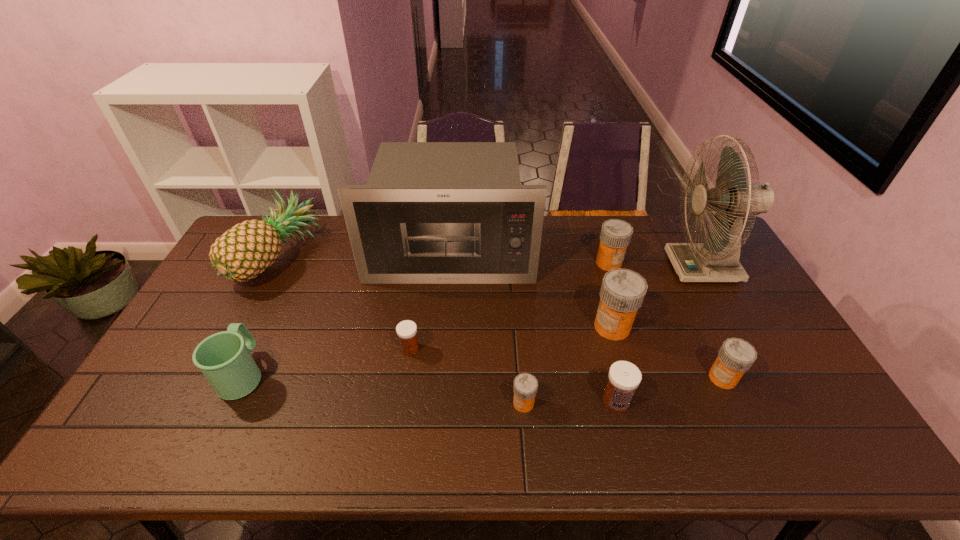
Identify the location of fan. (717, 259).

Where is `gray fan`? Image resolution: width=960 pixels, height=540 pixels. gray fan is located at coordinates (717, 259).

The height and width of the screenshot is (540, 960). In order to click on gray microwave oven in this screenshot , I will do `click(431, 212)`.

Find the location of `the ninth shortest object`. the ninth shortest object is located at coordinates (431, 212).

Identify the location of pineapple. (247, 249).

The width and height of the screenshot is (960, 540). I want to click on the second farthest orange medicine, so click(x=622, y=292).

Locate an element on the screen. the tallest medicine is located at coordinates (622, 292).

I want to click on the farthest medicine, so click(615, 236).

Identify the location of the farthest orange medicine. The height and width of the screenshot is (540, 960). (615, 236).

Identify the location of green mug. Image resolution: width=960 pixels, height=540 pixels. (224, 359).